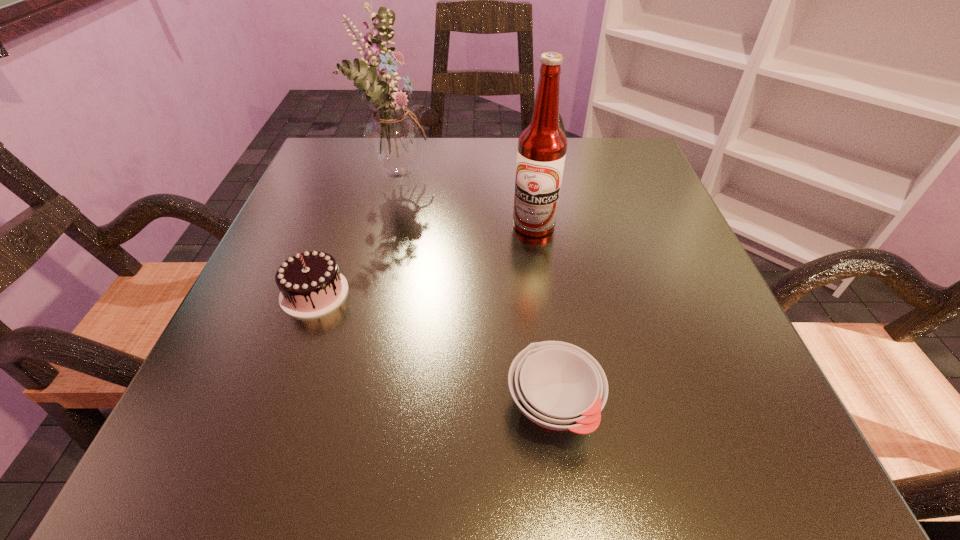
Identify the location of the farthest object. [393, 138].

Find the location of a particular element. alcohol is located at coordinates (542, 146).

Identify the location of the third farthest object. (310, 284).

This screenshot has width=960, height=540. Find the location of `the second shortest object`. the second shortest object is located at coordinates (310, 284).

At what (x,y) coordinates should I click in order to perform the action: click on soup bowl. Please return your answer as a coordinate pair (x, y). Looking at the image, I should click on (557, 385).

You are a GUI agent. You are given a task and a screenshot of the screen. Output one action in this format:
    pyautogui.click(x=<x>, y=<y>)
    Task: Click on the shortest object
    The image size is (960, 540).
    Given the screenshot: What is the action you would take?
    pyautogui.click(x=557, y=385)

At what (x,y) coordinates should I click in order to perform the action: click on free spot located 0.110m on the front-facing side of the bouquet. Please return your answer as a coordinate pair (x, y). This screenshot has width=960, height=540. Looking at the image, I should click on (483, 171).

Locate an element on the screen. The height and width of the screenshot is (540, 960). vacant space situated on the label side of the third nearest object is located at coordinates (540, 266).

Locate an element on the screen. free spot located on the back of the third tallest object is located at coordinates (360, 167).

You are a GUI agent. You are given a task and a screenshot of the screen. Output one action in this format:
    pyautogui.click(x=<x>, y=<y>)
    Task: Click on the vacant area located 0.290m on the left of the soup bowl
    The image size is (960, 540).
    Given the screenshot: What is the action you would take?
    pyautogui.click(x=277, y=405)